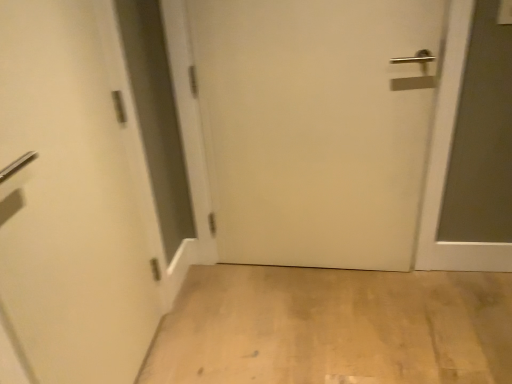
Identify the location of vacant area that is in front of white matte door at center, positioned as the first door in right-to-left order. (330, 328).